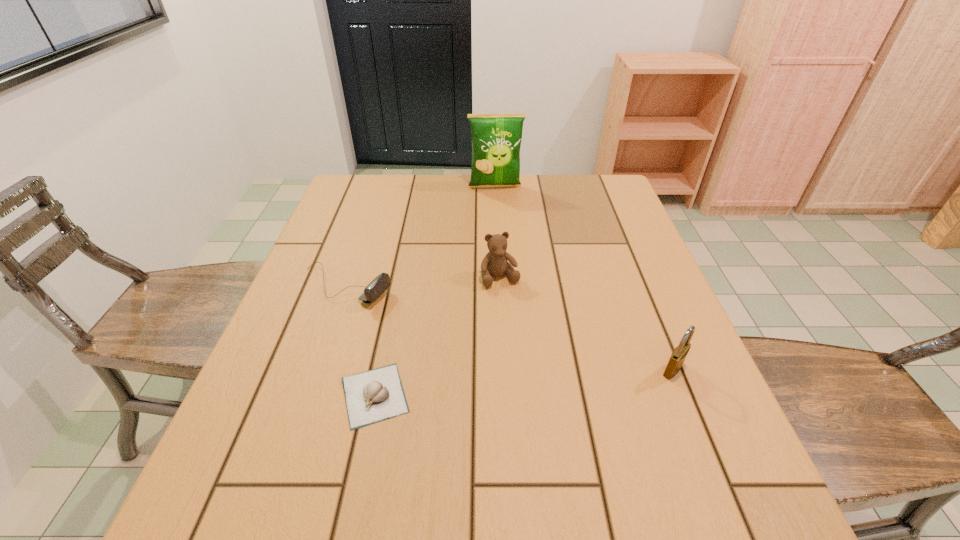
At what (x,y) coordinates should I click in order to perform the action: click on vacant area that lies between the second shortest object and the tallest object. Please return your answer as a coordinate pair (x, y). This screenshot has width=960, height=540. Looking at the image, I should click on (420, 237).

Identify the location of unoccupied position between the shortest object and the teddy bear. [438, 336].

Identify the location of empty space between the crisp (potato chip) and the rightmost object. (584, 278).

This screenshot has height=540, width=960. I want to click on vacant point located between the farthest object and the teddy bear, so click(497, 232).

This screenshot has width=960, height=540. Identify the location of empty space that is in between the garlic and the rightmost object. (524, 382).

I want to click on empty space between the teddy bear and the crisp (potato chip), so click(x=497, y=232).

Locate an element on the screen. vacant space that is in between the webcam and the shortest object is located at coordinates (360, 341).

Image resolution: width=960 pixels, height=540 pixels. Find the location of `object that is the nearest to the padlock`. object that is the nearest to the padlock is located at coordinates (495, 263).

This screenshot has height=540, width=960. I want to click on object identified as the closest to the second shortest object, so tap(376, 395).

Locate an element on the screen. Image resolution: width=960 pixels, height=540 pixels. free location that satisfies the following two spatial constraints: 1. on the front side of the padlock; 2. on the right side of the tallest object is located at coordinates (504, 369).